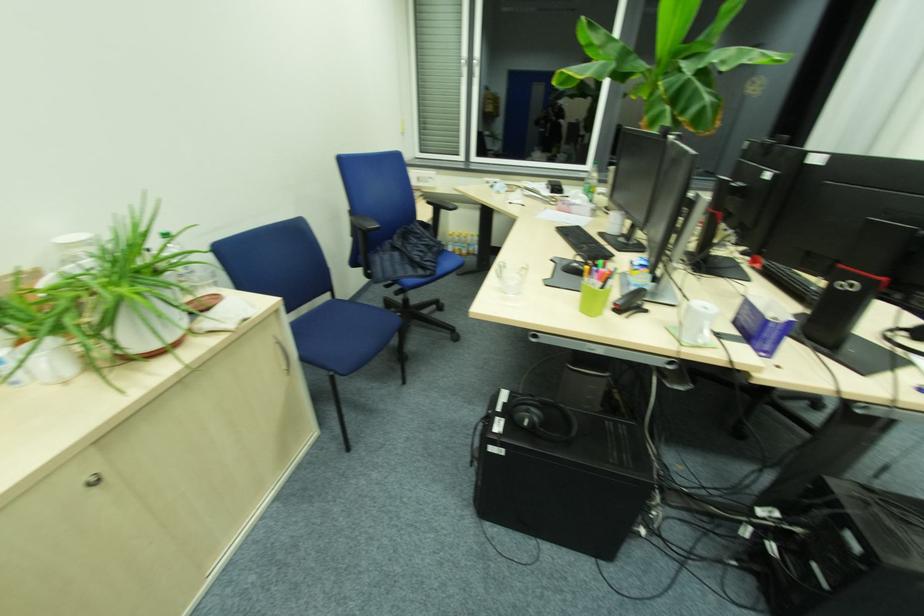
Find where to click the black computer mouse. Please return your answer as a coordinate pair (x, y).

(574, 267)